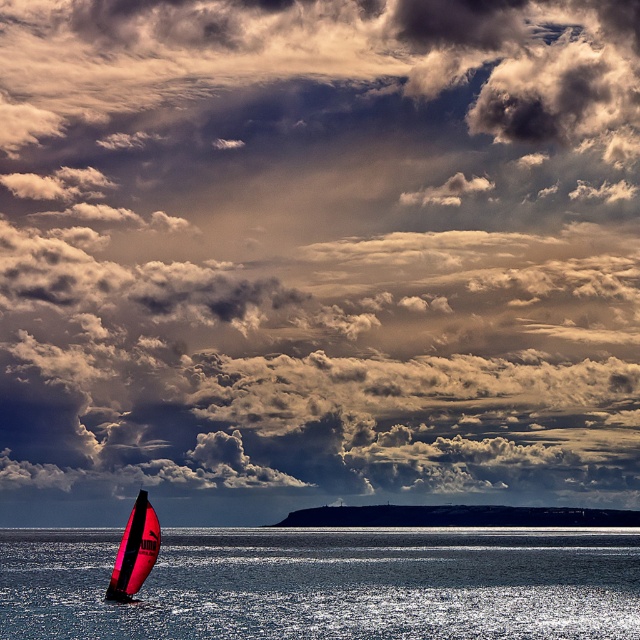
You are a sailor navigating a boat and need to determine the position of two points on your radar. The first point is labeled as point (x=404, y=621) and the second is point (x=150, y=538). Based on the image, which point is closer to your boat?

Point (x=404, y=621) is in front of point (x=150, y=538), so it is closer to the boat.

You are a photographer trying to capture the shiny pink sailboat at lower left and the transparent blue water at lower center in your shot. Based on their widths, which one should you focus on if you want to include the wider object in your frame?

The transparent blue water at lower center might be wider than shiny pink sailboat at lower left, so you should focus on the transparent blue water at lower center to include the wider object in your frame.